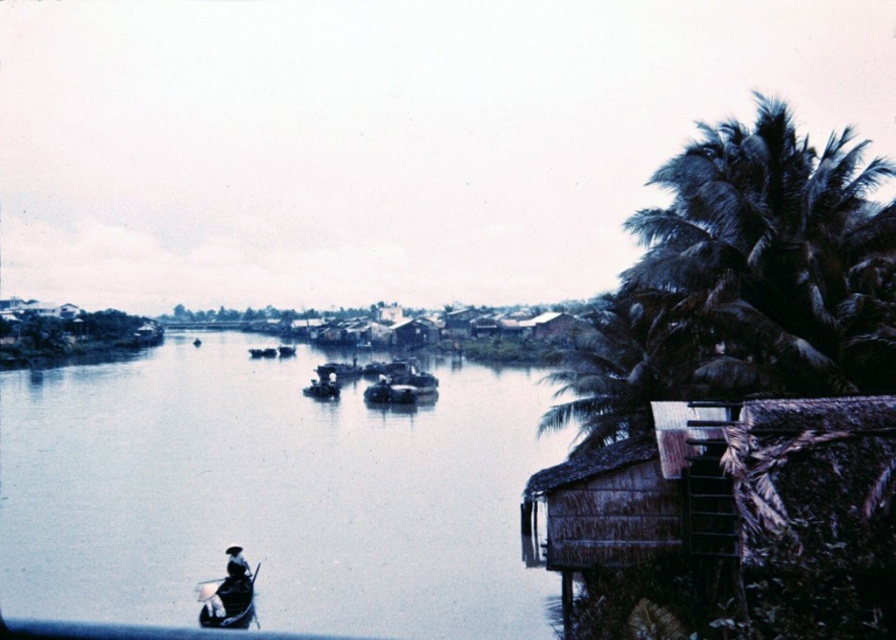
You are standing at the riverside and want to take a photo of the dark green leafy palm tree at right and the wooden canoe at lower left. Which object should you frame first in your camera viewfinder to ensure both are in the shot?

You should frame the wooden canoe at lower left first because the dark green leafy palm tree at right is to the right of the wooden canoe at lower left, so positioning the canoe first will allow you to include the palm tree in the frame by panning to the right.

You are a drone operator tasked with capturing aerial footage of the riverside scene. Your drone is currently positioned at point A, which is at coordinates 0.5, 0.5. You need to fly it to the dark green leafy palm tree at right. What direction should you move the drone to reach the palm tree?

The dark green leafy palm tree at right is located at coordinates (776,257). Since the drone is at (448,320), it should move slightly to the left and upwards to reach the palm tree.

Based on the scene description, where is the smooth water at center located in 2D coordinates?

The smooth water at center is located at the 2D coordinates point of (271, 493).